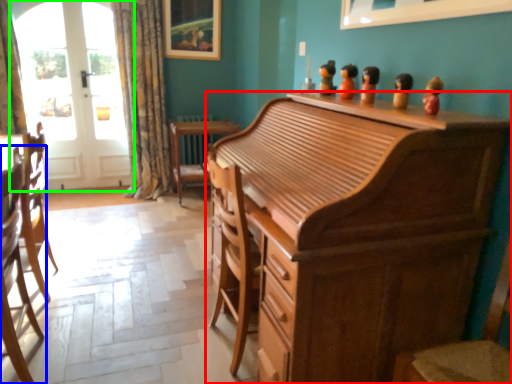
Question: Which object is positioned closest to cabinetry (highlighted by a red box)? Select from chair (highlighted by a blue box) and screen door (highlighted by a green box).

Choices:
 (A) chair
 (B) screen door

Answer: (A)